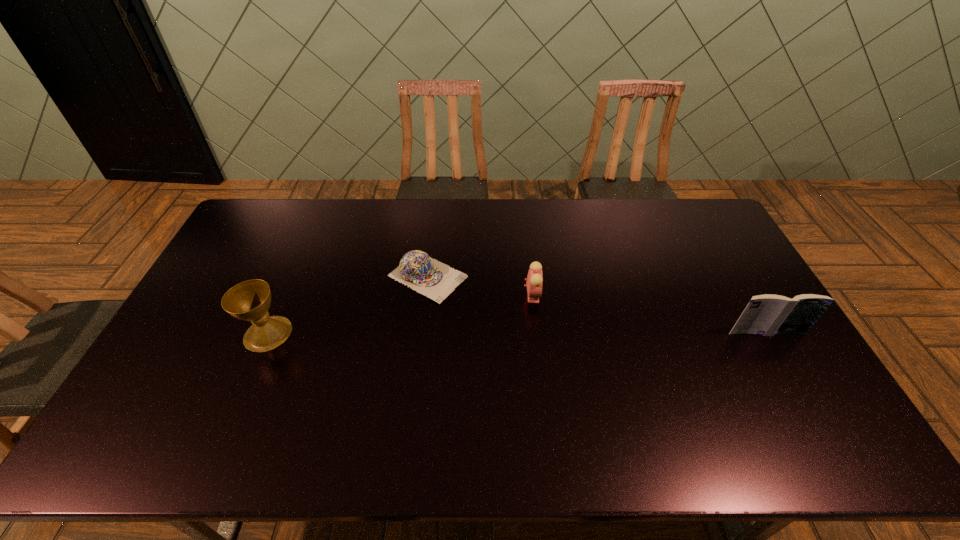
Identify the location of chalice. The width and height of the screenshot is (960, 540). (250, 300).

This screenshot has width=960, height=540. What are the coordinates of `the rightmost object` in the screenshot? It's located at (768, 314).

What are the coordinates of `alarm clock` in the screenshot? It's located at (534, 279).

Find the location of a particular element. the third tallest object is located at coordinates (534, 279).

You are a GUI agent. You are given a task and a screenshot of the screen. Output one action in this format:
    pyautogui.click(x=<x>, y=<y>)
    Task: Click on the cap
    The width and height of the screenshot is (960, 540).
    Given the screenshot: What is the action you would take?
    (x=427, y=276)

Locate an element on the screen. This screenshot has height=540, width=960. the shortest object is located at coordinates (427, 276).

What are the coordinates of `vacant space located 0.360m on the back of the leftmost object` in the screenshot? It's located at (308, 239).

This screenshot has width=960, height=540. I want to click on free space located on the front cover of the book, so click(x=780, y=356).

Where is `vacant area located on the face of the second object from right to left`? The height and width of the screenshot is (540, 960). vacant area located on the face of the second object from right to left is located at coordinates (x=647, y=372).

Identify the location of free region located on the face of the second object from right to left. The height and width of the screenshot is (540, 960). (558, 314).